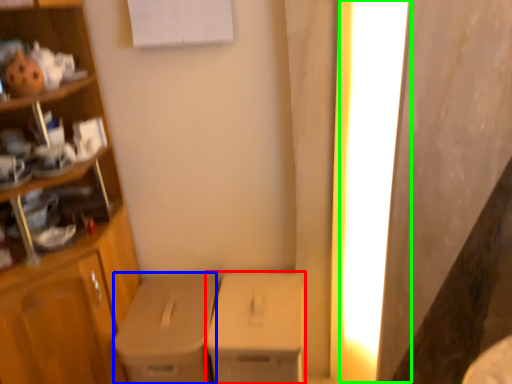
Question: Based on their relative distances, which object is farther from cardboard box (highlighted by a red box)? Choose from cardboard box (highlighted by a blue box) and lighting (highlighted by a green box).

Choices:
 (A) cardboard box
 (B) lighting

Answer: (B)